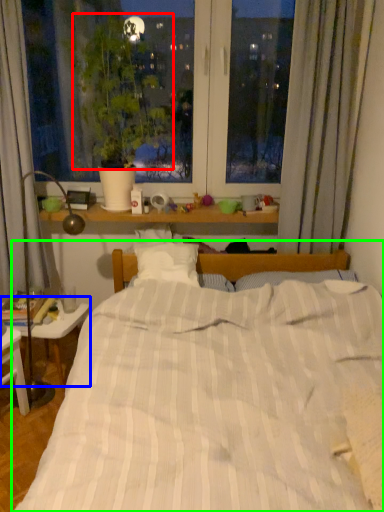
Question: Which is nearer to the plant (highlighted by a red box)? table (highlighted by a blue box) or bed (highlighted by a green box).

Choices:
 (A) table
 (B) bed

Answer: (B)